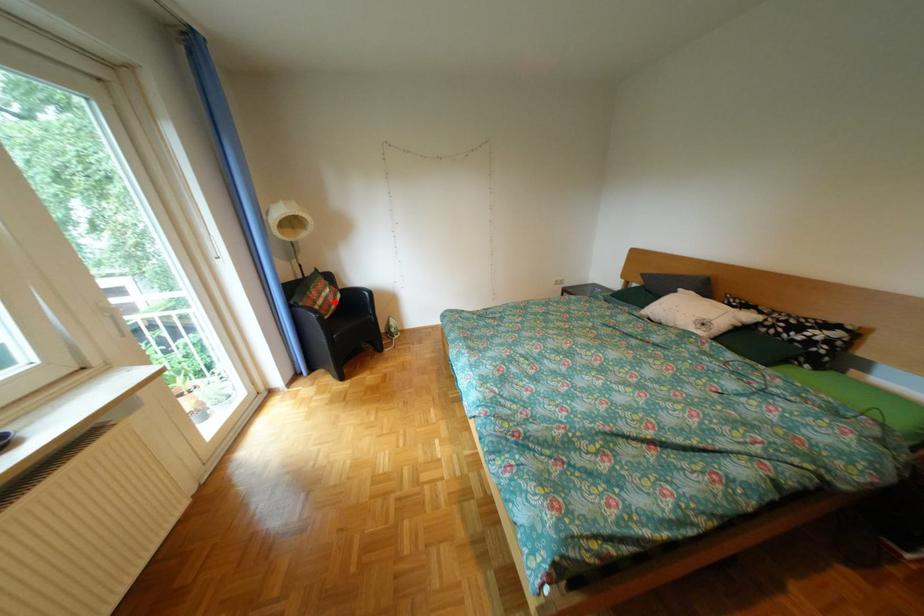
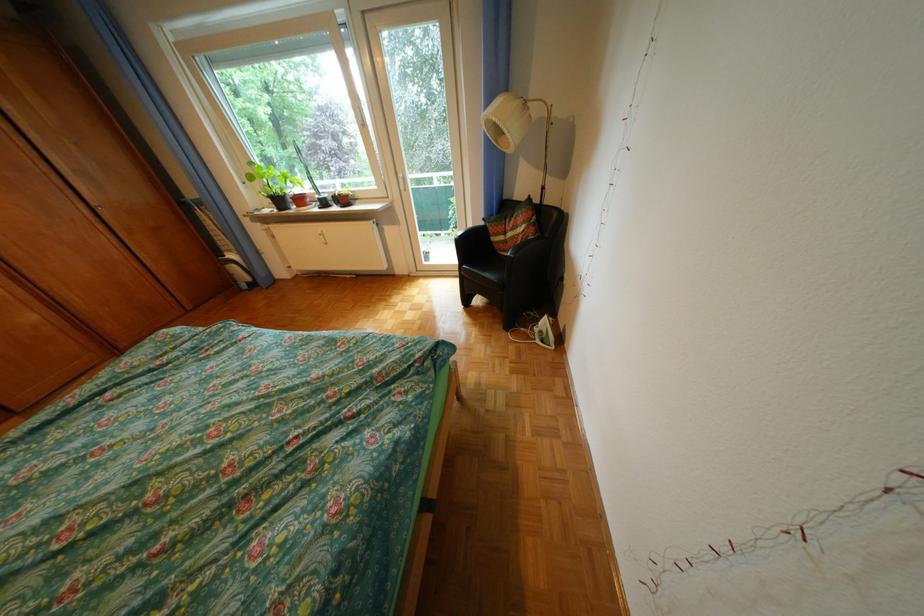
Question: I am providing you with two images of the same scene from different viewpoints. A red point is marked on the first image. Can you still see the location of the red point in image 2?

Choices:
 (A) Yes
 (B) No

Answer: (A)